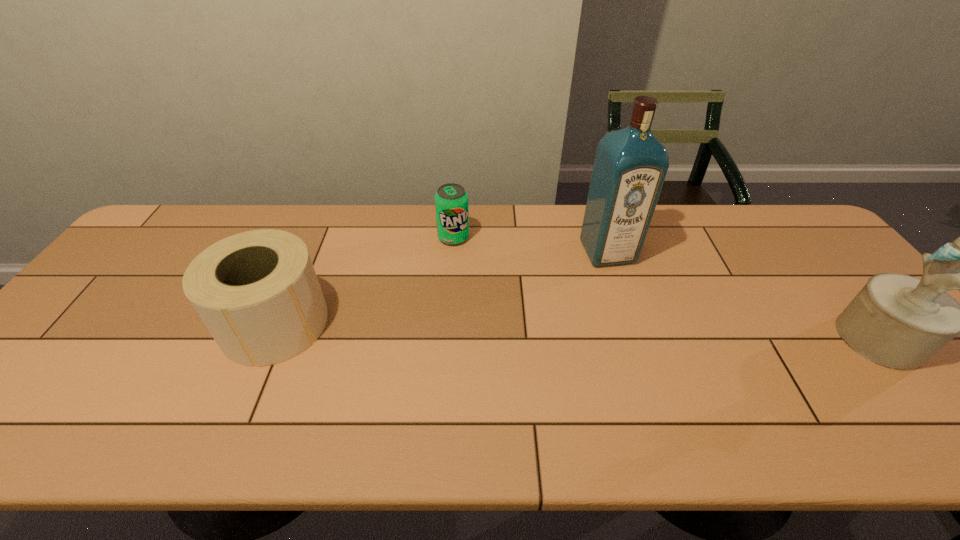
I want to click on vacant space that satisfies the following two spatial constraints: 1. on the front side of the toilet tissue; 2. at the beak of the figurine, so click(x=269, y=339).

Locate an element on the screen. The width and height of the screenshot is (960, 540). vacant space that satisfies the following two spatial constraints: 1. on the front side of the figurine; 2. at the beak of the shortest object is located at coordinates (446, 339).